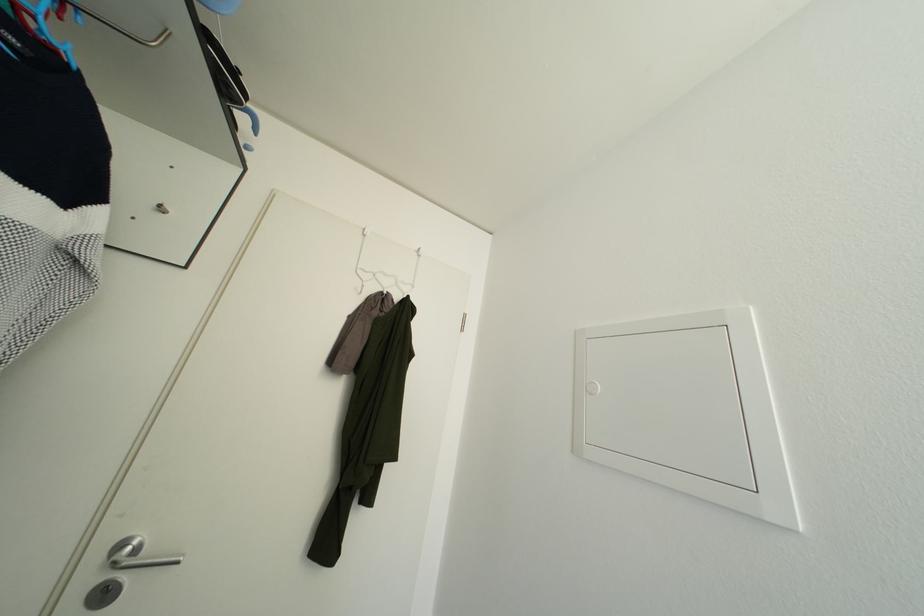
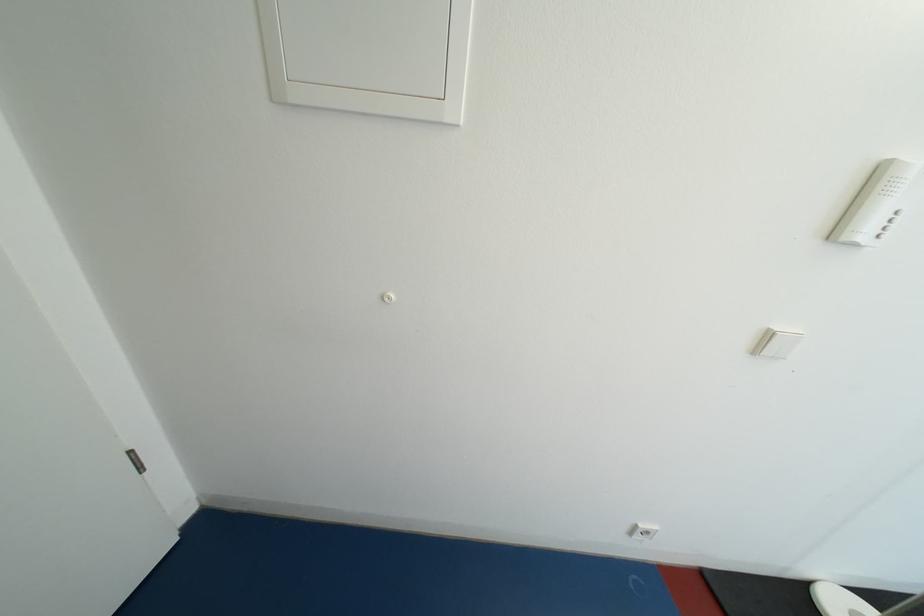
How did the camera likely rotate?

The camera rotated toward right-down.